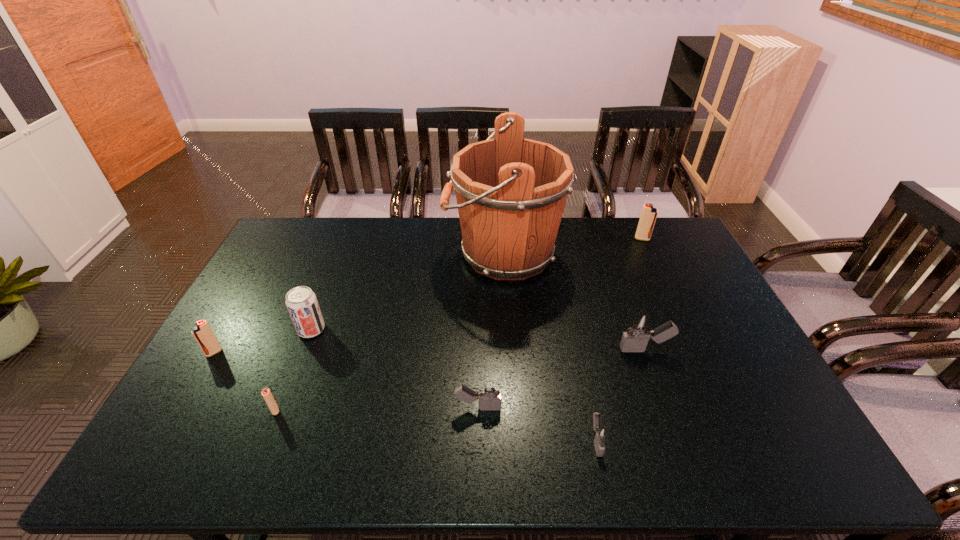
Identify the location of the second red igniter from left to right. This screenshot has width=960, height=540. (266, 393).

Where is `the nearest red igniter`? This screenshot has height=540, width=960. the nearest red igniter is located at coordinates [266, 393].

What are the coordinates of `the nearest gray igniter` in the screenshot? It's located at (600, 434).

The image size is (960, 540). Identify the location of the nearest igniter. (600, 434).

Identify the location of vacant space located with the handle on the side of the tallest object. (364, 253).

This screenshot has height=540, width=960. I want to click on blank space located 0.350m with the handle on the side of the tallest object, so click(348, 253).

Where is `free region located with the handle on the side of the tallest object`? This screenshot has height=540, width=960. free region located with the handle on the side of the tallest object is located at coordinates tap(353, 253).

Where is `free location located on the left of the rightmost red igniter`? free location located on the left of the rightmost red igniter is located at coordinates (550, 239).

The width and height of the screenshot is (960, 540). Identify the location of vacant space positioned 0.130m on the left of the second object from right to left. (574, 350).

At what (x,y) coordinates should I click in order to perform the action: click on free space located 0.280m on the back of the soda can. Please return your answer as a coordinate pair (x, y). The image size is (960, 540). Looking at the image, I should click on (337, 262).